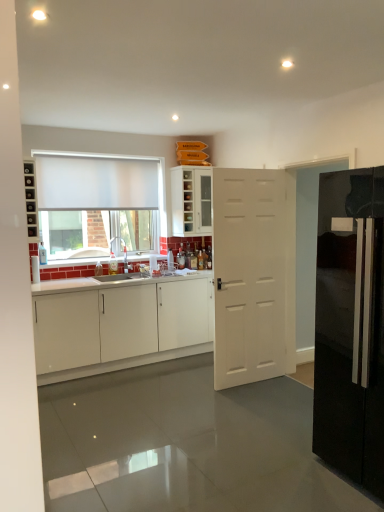
You are a GUI agent. You are given a task and a screenshot of the screen. Output one action in this format:
    pyautogui.click(x=<x>, y=<y>)
    Task: Click on the white matte curtain at upper left
    
    Given the screenshot: What is the action you would take?
    pyautogui.click(x=95, y=183)

Where is `white matte door at center`? white matte door at center is located at coordinates (253, 275).

Measure the distance between point (330, 381) and camera.

8.35 feet.

In order to face glossy black refrigerator at right, should I rotate leftwards or rightwards?

Turn right by 24.771 degrees to look at glossy black refrigerator at right.

Where is `white matte cabinet at left, which is the 1th cabinetry in bottom-to-top order`? Image resolution: width=384 pixels, height=512 pixels. white matte cabinet at left, which is the 1th cabinetry in bottom-to-top order is located at coordinates (120, 327).

Considering the points (342, 419) and (173, 213), which point is in front, point (342, 419) or point (173, 213)?

The point (342, 419) is in front.

Is white glass cabinet at center, the 2th cabinetry when ordered from bottom to top, surrounded by glossy black refrigerator at right?

No, white glass cabinet at center, the 2th cabinetry when ordered from bottom to top, is not a part of glossy black refrigerator at right.

In the image, is glossy black refrigerator at right positioned in front of or behind white glass cabinet at center, the 2th cabinetry when ordered from bottom to top?

In the image, glossy black refrigerator at right appears in front of white glass cabinet at center, the 2th cabinetry when ordered from bottom to top.

From the image's perspective, which is below, glossy black refrigerator at right or white glass cabinet at center, positioned as the first cabinetry in top-to-bottom order?

glossy black refrigerator at right is shown below in the image.

From a real-world perspective, between white matte window at upper left and white matte door at center, who is vertically higher?

In real-world perspective, white matte window at upper left is above.

Is white matte window at upper left not close to white matte door at center?

Yes, white matte window at upper left and white matte door at center are quite far apart.

The image size is (384, 512). I want to click on door located on the right of white matte window at upper left, so click(x=253, y=275).

Which object is further away from the camera, glossy black refrigerator at right or white matte curtain at upper left?

Positioned behind is white matte curtain at upper left.

From the image's perspective, which is above, glossy black refrigerator at right or white matte curtain at upper left?

white matte curtain at upper left, from the image's perspective.

Would you say glossy black refrigerator at right is a long distance from white matte curtain at upper left?

Absolutely, glossy black refrigerator at right is distant from white matte curtain at upper left.

Considering the positions of points (359, 419) and (77, 197), is point (359, 419) closer to camera compared to point (77, 197)?

That is True.

From the image's perspective, relative to white matte curtain at upper left, is white matte window at upper left above or below?

Clearly, from the image's perspective, white matte window at upper left is below white matte curtain at upper left.

Which object is positioned more to the left, white matte window at upper left or white matte curtain at upper left?

white matte window at upper left.

Is white matte window at upper left completely or partially outside of white matte curtain at upper left?

Actually, white matte window at upper left is within white matte curtain at upper left.

Considering the sizes of glossy black refrigerator at right and white matte window at upper left in the image, is glossy black refrigerator at right bigger or smaller than white matte window at upper left?

In the image, glossy black refrigerator at right appears to be larger than white matte window at upper left.

Is the depth of glossy black refrigerator at right less than that of white matte window at upper left?

Yes, the depth of glossy black refrigerator at right is less than that of white matte window at upper left.

Does glossy black refrigerator at right turn towards white matte window at upper left?

No.

Is white matte curtain at upper left taller or shorter than white matte cabinet at left, the second cabinetry when ordered from top to bottom?

white matte curtain at upper left is shorter than white matte cabinet at left, the second cabinetry when ordered from top to bottom.

Is white matte curtain at upper left located outside white matte cabinet at left, the second cabinetry when ordered from top to bottom?

white matte curtain at upper left lies outside white matte cabinet at left, the second cabinetry when ordered from top to bottom,'s area.

Is the position of white matte curtain at upper left more distant than that of white matte cabinet at left, the second cabinetry when ordered from top to bottom?

Yes, white matte curtain at upper left is further from the viewer.

Can you confirm if white matte door at center is thinner than white matte cabinet at left, which is the 1th cabinetry in bottom-to-top order?

Yes.

Would you say white matte door at center is inside or outside white matte cabinet at left, the second cabinetry when ordered from top to bottom?

white matte door at center cannot be found inside white matte cabinet at left, the second cabinetry when ordered from top to bottom.

How many degrees apart are the facing directions of white matte door at center and white matte cabinet at left, the second cabinetry when ordered from top to bottom?

There is a 2.49-degree angle between the facing directions of white matte door at center and white matte cabinet at left, the second cabinetry when ordered from top to bottom.

At what (x,y) coordinates should I click in order to perform the action: click on cabinetry that appears below the white matte door at center (from a real-world perspective). Please return your answer as a coordinate pair (x, y). Image resolution: width=384 pixels, height=512 pixels. Looking at the image, I should click on (120, 327).

Find the location of a particular element. refrigerator in front of the white glass cabinet at center, positioned as the first cabinetry in top-to-bottom order is located at coordinates (350, 326).

The height and width of the screenshot is (512, 384). I want to click on window above the white matte door at center (from the image's perspective), so click(97, 204).

Considering their positions, is white matte curtain at upper left positioned closer to white matte cabinet at left, which is the 1th cabinetry in bottom-to-top order, than white matte window at upper left?

white matte window at upper left is closer to white matte cabinet at left, which is the 1th cabinetry in bottom-to-top order.

From the image, which object appears to be nearer to glossy black refrigerator at right, white matte curtain at upper left or white matte door at center?

Based on the image, white matte door at center appears to be nearer to glossy black refrigerator at right.

Which object lies further to the anchor point white matte window at upper left, matte black shelves at left or glossy black refrigerator at right?

Based on the image, matte black shelves at left appears to be further to white matte window at upper left.

From the picture: Which object lies nearer to the anchor point matte black shelves at left, white matte window at upper left or white matte cabinet at left, which is the 1th cabinetry in bottom-to-top order?

The object closer to matte black shelves at left is white matte cabinet at left, which is the 1th cabinetry in bottom-to-top order.

Estimate the real-world distances between objects in this image. Which object is further from white matte window at upper left, white matte curtain at upper left or glossy black refrigerator at right?

glossy black refrigerator at right.

Looking at the image, which one is located closer to white matte window at upper left, white glass cabinet at center, positioned as the first cabinetry in top-to-bottom order, or white matte curtain at upper left?

white matte curtain at upper left lies closer to white matte window at upper left than the other object.

Looking at this image, estimate the real-world distances between objects in this image. Which object is closer to white matte curtain at upper left, white glass cabinet at center, positioned as the first cabinetry in top-to-bottom order, or white matte cabinet at left, the second cabinetry when ordered from top to bottom?

white glass cabinet at center, positioned as the first cabinetry in top-to-bottom order, is closer to white matte curtain at upper left.

Which object lies further to the anchor point glossy black refrigerator at right, white matte cabinet at left, the second cabinetry when ordered from top to bottom, or white matte window at upper left?

Among the two, white matte window at upper left is located further to glossy black refrigerator at right.

In order to click on window between glossy black refrigerator at right and white glass cabinet at center, the 2th cabinetry when ordered from bottom to top, along the z-axis in this screenshot , I will do `click(97, 204)`.

Image resolution: width=384 pixels, height=512 pixels. Find the location of `cabinetry located between glossy black refrigerator at right and white matte window at upper left in the depth direction`. cabinetry located between glossy black refrigerator at right and white matte window at upper left in the depth direction is located at coordinates (120, 327).

Find the location of a particular element. Image resolution: width=384 pixels, height=512 pixels. cabinetry between matte black shelves at left and white glass cabinet at center, the 2th cabinetry when ordered from bottom to top is located at coordinates (120, 327).

Identify the location of curtain between white matte window at upper left and white glass cabinet at center, positioned as the first cabinetry in top-to-bottom order. This screenshot has width=384, height=512. (95, 183).